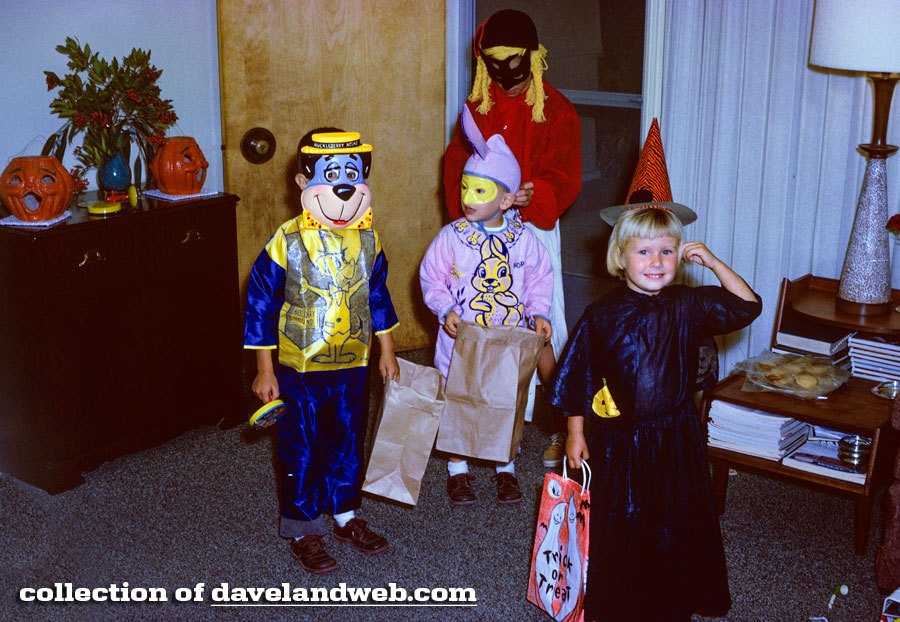
Where is `curtain`? The image size is (900, 622). curtain is located at coordinates (723, 122).